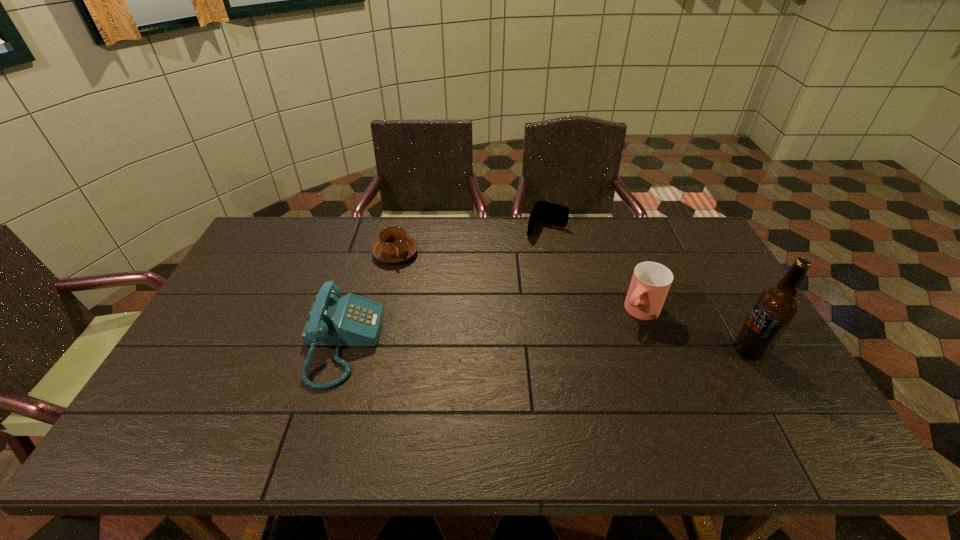
Where is `object that is the third nearest to the beer bottle`? This screenshot has width=960, height=540. object that is the third nearest to the beer bottle is located at coordinates (394, 245).

Identify the location of free space that satisfies the following two spatial constraints: 1. on the front side of the fourth object from left to right; 2. on the left side of the cappuccino. click(x=383, y=310).